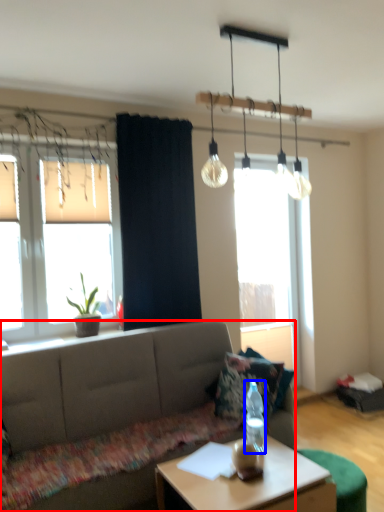
Question: Which of the following is the closest to the observer, studio couch (highlighted by a red box) or bottle (highlighted by a blue box)?

Choices:
 (A) studio couch
 (B) bottle

Answer: (A)